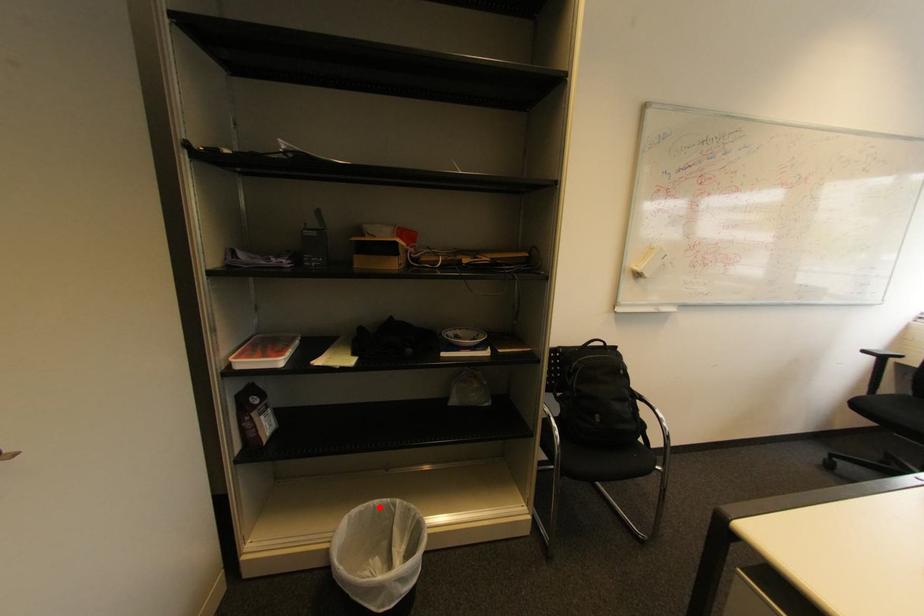
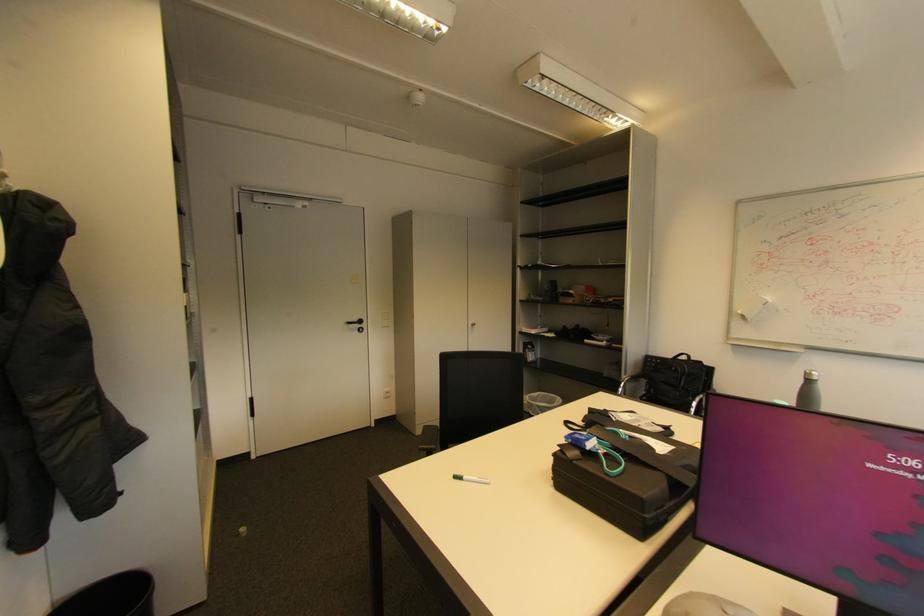
Question: A red point is marked in image1. In image2, is the corresponding 3D point closer to the camera or farther? Reply with the corresponding letter.

Choices:
 (A) The corresponding 3D point is closer.
 (B) The corresponding 3D point is farther.

Answer: (B)